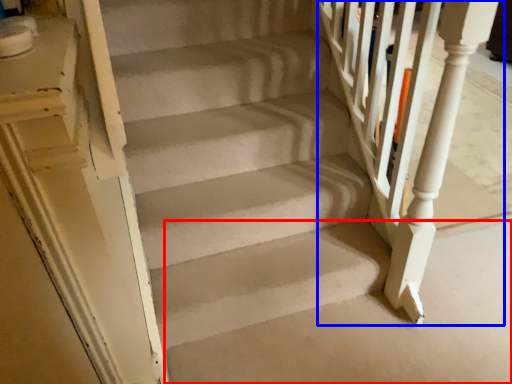
Question: Which point is closer to the camera, concrete (highlighted by a red box) or rail (highlighted by a blue box)?

Choices:
 (A) concrete
 (B) rail

Answer: (B)